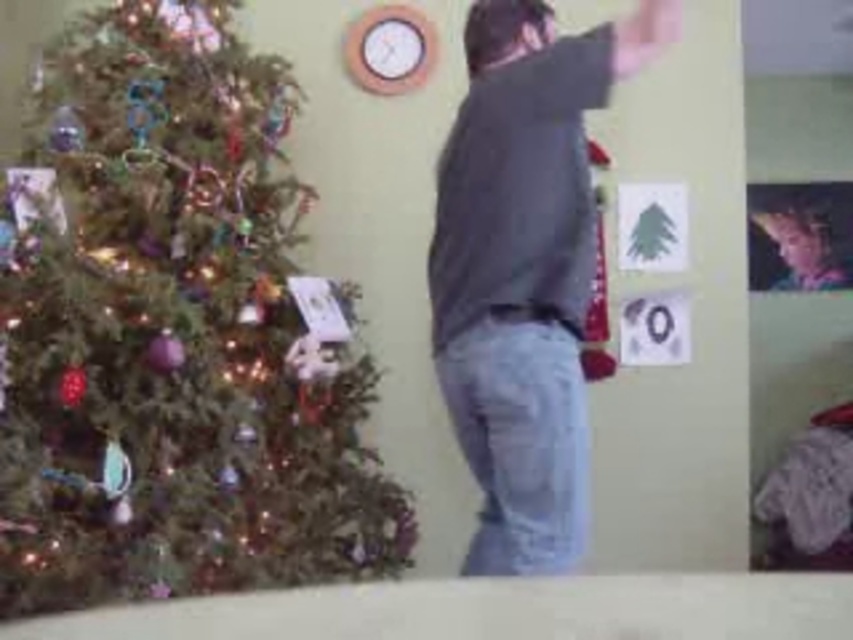
You are standing in the festive indoor scene with the Christmas tree. You see two points marked in the image. Which point is closer to you, point (149,211) or point (431,253)?

Point (149,211) is closer to you because it is further to the viewer than point (431,253).

You are a photographer trying to capture a photo of the shiny green tree at left and the dark gray hoodie at center. Since you want both subjects to be clearly visible in the frame, which object should you focus on first to ensure proper focus?

The shiny green tree at left is taller than the dark gray hoodie at center, so focusing on the tree first will help ensure both are in focus as it is the larger subject in the frame.

You are trying to decide whether to place a new decoration on the shiny green tree at left or the dark gray hoodie at center. Which object is wider?

The shiny green tree at left is wider than the dark gray hoodie at center, so you should place the decoration on the tree.